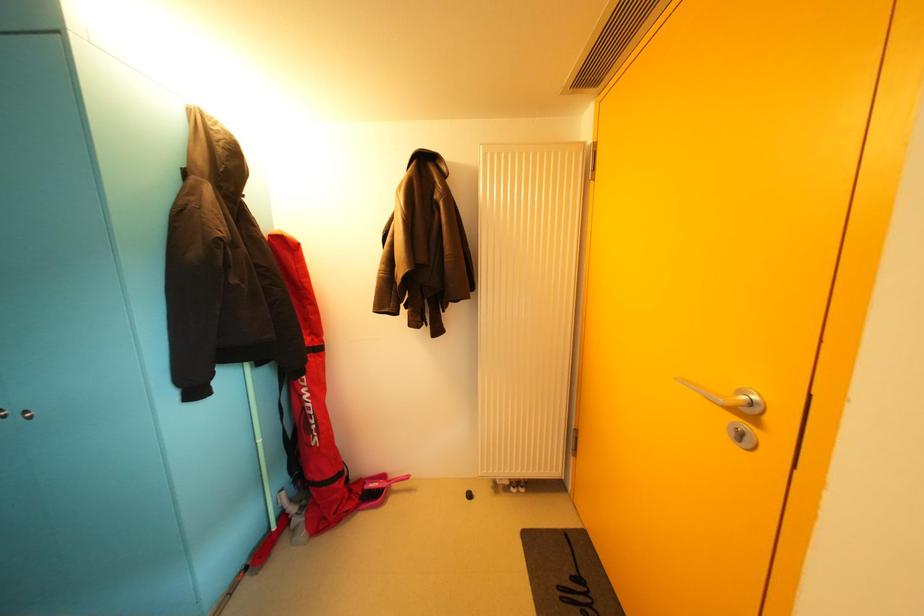
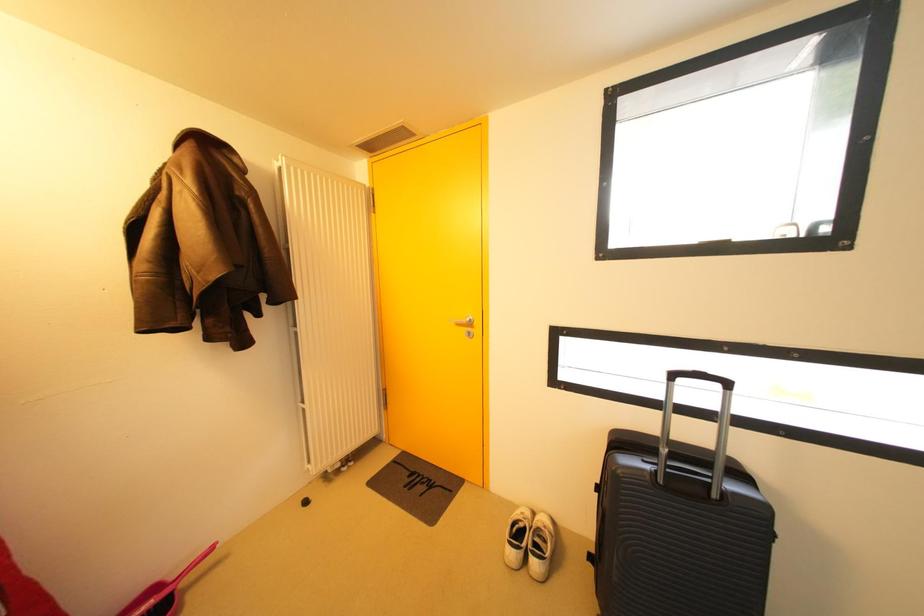
Question: The images are taken continuously from a first-person perspective. In which direction is your viewpoint rotating?

Choices:
 (A) Left
 (B) Right
 (C) Up
 (D) Down

Answer: (B)